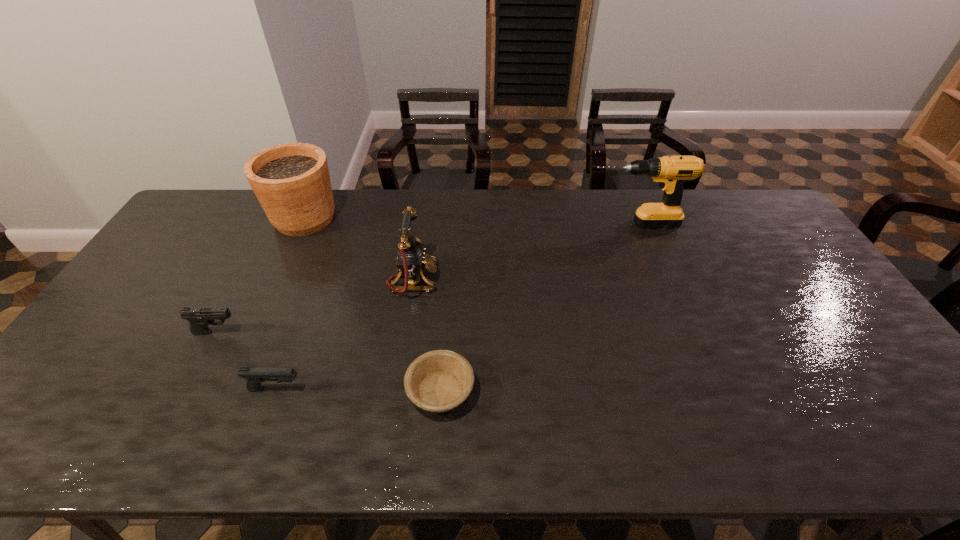
Find the location of `free space at the right edge of the desktop`. free space at the right edge of the desktop is located at coordinates pos(805,332).

Where is `vacant space at the far left corner of the desktop`? The height and width of the screenshot is (540, 960). vacant space at the far left corner of the desktop is located at coordinates (235, 209).

Find the location of a particular element. Image resolution: width=960 pixels, height=540 pixels. vacant space at the far right corner of the desktop is located at coordinates (767, 224).

I want to click on free space between the flowerpot and the third nearest object, so click(x=260, y=275).

Where is `free space between the flowerpot and the nearer pistol`? The height and width of the screenshot is (540, 960). free space between the flowerpot and the nearer pistol is located at coordinates (290, 304).

Locate an element on the screen. The image size is (960, 540). empty space that is in between the nearer pistol and the bowl is located at coordinates (358, 390).

The image size is (960, 540). I want to click on free space between the telephone and the nearer pistol, so click(345, 334).

Locate an element on the screen. Image resolution: width=960 pixels, height=540 pixels. empty space between the farther pistol and the shortest object is located at coordinates 328,361.

Identify the location of free space between the telephone and the drill. The width and height of the screenshot is (960, 540). click(x=523, y=252).

At what (x,y) coordinates should I click in order to perform the action: click on free point between the drill and the flowerpot. Please return your answer as a coordinate pair (x, y). Image resolution: width=960 pixels, height=540 pixels. Looking at the image, I should click on (468, 221).